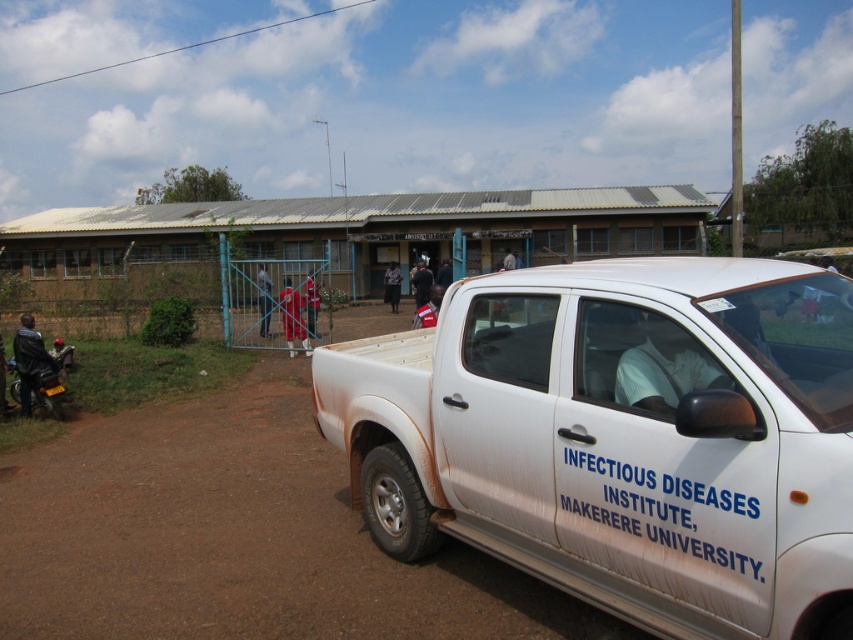
What are the coordinates of `red fabric pants at center` in the screenshot? It's located at (x=264, y=300).

Is red fabric pants at center smaller than red fabric person at center?

No, red fabric pants at center is not smaller than red fabric person at center.

Does point (265, 337) come behind point (310, 292)?

Yes.

You are a GUI agent. You are given a task and a screenshot of the screen. Output one action in this format:
    pyautogui.click(x=<x>, y=<y>)
    Task: Click on the red fabric pants at center
    The image size is (853, 640).
    Given the screenshot: What is the action you would take?
    pyautogui.click(x=264, y=300)

From the picture: Can you confirm if white matte truck at center is positioned to the left of red fabric pants at center?

Incorrect, white matte truck at center is not on the left side of red fabric pants at center.

Looking at this image, which is more to the left, white matte truck at center or red fabric pants at center?

Positioned to the left is red fabric pants at center.

This screenshot has height=640, width=853. In order to click on white matte truck at center in this screenshot , I will do [x=621, y=436].

Does red fabric cloth at center lie behind dark blue fabric jacket at center?

No.

Is point (285, 301) closer to viewer compared to point (422, 291)?

Yes, point (285, 301) is closer to viewer.

This screenshot has height=640, width=853. Identify the location of red fabric cloth at center. (292, 317).